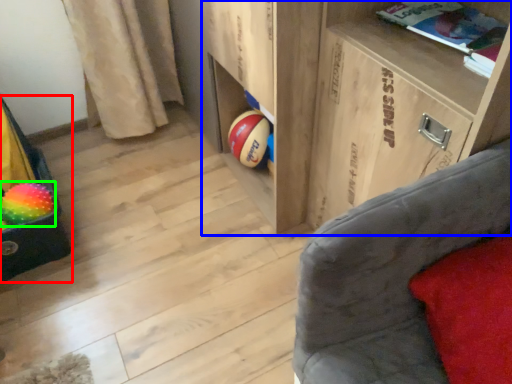
Question: Which is nearer to the bean bag chair (highlighted by a red box)? shelf (highlighted by a blue box) or beach ball (highlighted by a green box).

Choices:
 (A) shelf
 (B) beach ball

Answer: (B)